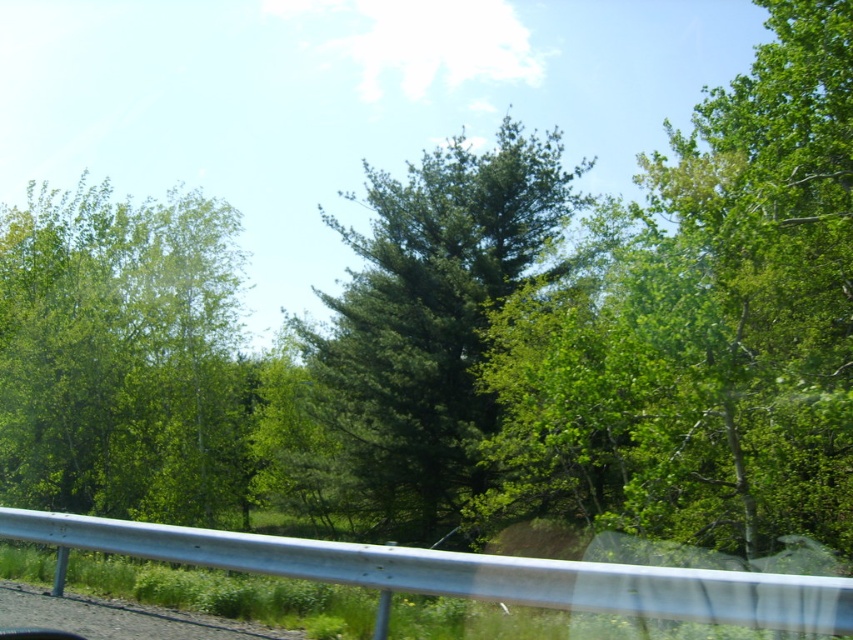
You are driving along a forest road and notice two trees ahead. The first is a green leafy tree at left and the second is a green matte tree at center. Which tree is shorter?

The green leafy tree at left is shorter than the green matte tree at center.

Based on the photo, you are standing at the guardrail in the image. Looking towards the forest, where is the green leafy tree at center located in relation to your position?

The green leafy tree at center is located at the central part of the forest area in front of you, specifically at coordinates point [701,324].

You are standing at the guardrail in the forest scene. You see two points marked in the image. Which point is closer to you? The points are point (735, 156) and point (30, 248).

Point (735, 156) is in front of point (30, 248), so it is closer to you.